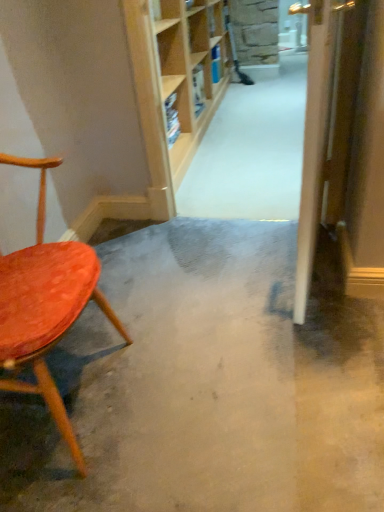
What do you see at coordinates (207, 385) in the screenshot? Image resolution: width=384 pixels, height=512 pixels. I see `smooth concrete floor at center` at bounding box center [207, 385].

The image size is (384, 512). Identify the location of wooden door at right. (326, 124).

Identify the location of smooth concrete floor at center. (207, 385).

How distant is smooth concrete floor at center from wooden bookshelf at upper center?

A distance of 4.71 feet exists between smooth concrete floor at center and wooden bookshelf at upper center.

Locate an element on the screen. concrete lying below the wooden bookshelf at upper center (from the image's perspective) is located at coordinates (207, 385).

Is point (328, 261) closer to camera compared to point (220, 16)?

Yes, point (328, 261) is in front of point (220, 16).

In the scene shown: Is smooth concrete floor at center situated inside wooden bookshelf at upper center or outside?

smooth concrete floor at center is located beyond the bounds of wooden bookshelf at upper center.

Visually, is wooden bookshelf at upper center positioned to the left or to the right of smooth concrete floor at center?

wooden bookshelf at upper center is positioned on smooth concrete floor at center's left side.

Is wooden bookshelf at upper center positioned behind smooth concrete floor at center?

Yes.

Identify the location of concrete beneath the wooden bookshelf at upper center (from a real-world perspective). This screenshot has height=512, width=384. (207, 385).

Considering the positions of point (198, 41) and point (344, 488), is point (198, 41) closer or farther from the camera than point (344, 488)?

Clearly, point (198, 41) is more distant from the camera than point (344, 488).

The width and height of the screenshot is (384, 512). In order to click on shelf to the left of wooden door at right in this screenshot , I will do `click(173, 77)`.

Is wooden door at right directly adjacent to wooden bookshelf at upper center?

No.

Measure the distance between wooden door at right and wooden bookshelf at upper center.

wooden door at right is 1.33 meters from wooden bookshelf at upper center.

Is wooden door at right bigger than wooden bookshelf at upper center?

No, wooden door at right is not bigger than wooden bookshelf at upper center.

In the scene shown: Considering the positions of objects velvet orange chair at left and smooth concrete floor at center in the image provided, who is behind, velvet orange chair at left or smooth concrete floor at center?

smooth concrete floor at center is behind.

Which object is positioned more to the left, velvet orange chair at left or smooth concrete floor at center?

From the viewer's perspective, velvet orange chair at left appears more on the left side.

Considering the relative sizes of velvet orange chair at left and smooth concrete floor at center in the image provided, is velvet orange chair at left taller than smooth concrete floor at center?

Yes, velvet orange chair at left is taller than smooth concrete floor at center.

Where is `chair to the left of smooth concrete floor at center`? chair to the left of smooth concrete floor at center is located at coordinates (46, 305).

Considering the relative sizes of wooden bookshelf at upper center and wooden door at right in the image provided, is wooden bookshelf at upper center wider than wooden door at right?

Yes, wooden bookshelf at upper center is wider than wooden door at right.

Between wooden bookshelf at upper center and wooden door at right, which one has smaller size?

Smaller between the two is wooden door at right.

This screenshot has width=384, height=512. In the image, there is a wooden door at right. Identify the location of shelf above it (from the image's perspective). (173, 77).

From the image's perspective, is wooden bookshelf at upper center located beneath wooden door at right?

Actually, wooden bookshelf at upper center appears above wooden door at right in the image.

Which is closer to the camera, (304, 483) or (311, 26)?

The point (311, 26) is in front.

Is smooth concrete floor at center outside of wooden door at right?

Yes.

Is smooth concrete floor at center looking in the opposite direction of wooden door at right?

smooth concrete floor at center does not have its back to wooden door at right.

Which object is thinner, smooth concrete floor at center or wooden door at right?

wooden door at right is thinner.

Are wooden door at right and smooth concrete floor at center beside each other?

wooden door at right and smooth concrete floor at center are not in contact.

This screenshot has width=384, height=512. I want to click on door above the smooth concrete floor at center (from the image's perspective), so click(x=326, y=124).

From the picture: Which object is wider, wooden door at right or smooth concrete floor at center?

smooth concrete floor at center is wider.

You are a GUI agent. You are given a task and a screenshot of the screen. Output one action in this format:
    pyautogui.click(x=<x>, y=<y>)
    Task: Click on the shelf on the left of smooth concrete floor at center
    The height and width of the screenshot is (512, 384).
    Given the screenshot: What is the action you would take?
    pyautogui.click(x=173, y=77)

The image size is (384, 512). In order to click on shelf that appears above the smooth concrete floor at center (from a real-world perspective) in this screenshot , I will do `click(173, 77)`.

Estimate the real-world distances between objects in this image. Which object is further from wooden door at right, velvet orange chair at left or wooden bookshelf at upper center?

The object further to wooden door at right is wooden bookshelf at upper center.

Considering their positions, is smooth concrete floor at center positioned closer to wooden bookshelf at upper center than velvet orange chair at left?

smooth concrete floor at center is closer to wooden bookshelf at upper center.

Estimate the real-world distances between objects in this image. Which object is closer to wooden door at right, wooden bookshelf at upper center or velvet orange chair at left?

velvet orange chair at left is positioned closer to the anchor wooden door at right.

From the image, which object appears to be nearer to smooth concrete floor at center, velvet orange chair at left or wooden bookshelf at upper center?

velvet orange chair at left.

From the image, which object appears to be nearer to wooden bookshelf at upper center, velvet orange chair at left or wooden door at right?

Among the two, wooden door at right is located nearer to wooden bookshelf at upper center.

Considering their positions, is velvet orange chair at left positioned further to wooden bookshelf at upper center than smooth concrete floor at center?

The object further to wooden bookshelf at upper center is velvet orange chair at left.

From the image, which object appears to be farther from velvet orange chair at left, wooden bookshelf at upper center or smooth concrete floor at center?

The object further to velvet orange chair at left is wooden bookshelf at upper center.

Estimate the real-world distances between objects in this image. Which object is closer to velvet orange chair at left, wooden door at right or wooden bookshelf at upper center?

Among the two, wooden door at right is located nearer to velvet orange chair at left.

Where is `door between wooden bookshelf at upper center and velvet orange chair at left in the vertical direction`? The width and height of the screenshot is (384, 512). door between wooden bookshelf at upper center and velvet orange chair at left in the vertical direction is located at coordinates (326, 124).

Where is `chair between wooden bookshelf at upper center and smooth concrete floor at center in the up-down direction`? chair between wooden bookshelf at upper center and smooth concrete floor at center in the up-down direction is located at coordinates (46, 305).

Where is `door between wooden bookshelf at upper center and smooth concrete floor at center from top to bottom`? The image size is (384, 512). door between wooden bookshelf at upper center and smooth concrete floor at center from top to bottom is located at coordinates (326, 124).

The height and width of the screenshot is (512, 384). Find the location of `concrete located between velvet orange chair at left and wooden door at right in the left-right direction`. concrete located between velvet orange chair at left and wooden door at right in the left-right direction is located at coordinates (207, 385).